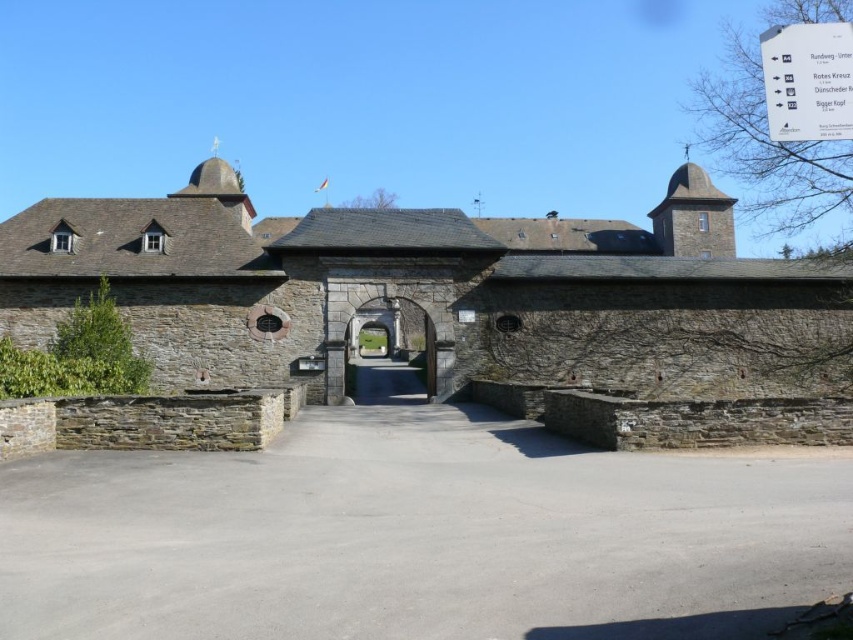
Question: Does gray concrete driveway at center have a greater width compared to stone archway at center?

Choices:
 (A) yes
 (B) no

Answer: (A)

Question: Which of the following is the farthest from the observer?

Choices:
 (A) (347, 384)
 (B) (610, 532)

Answer: (A)

Question: Is gray concrete driveway at center bigger than stone archway at center?

Choices:
 (A) yes
 (B) no

Answer: (B)

Question: Which object is closer to the camera taking this photo?

Choices:
 (A) stone archway at center
 (B) gray concrete driveway at center

Answer: (B)

Question: Is gray concrete driveway at center smaller than stone archway at center?

Choices:
 (A) no
 (B) yes

Answer: (B)